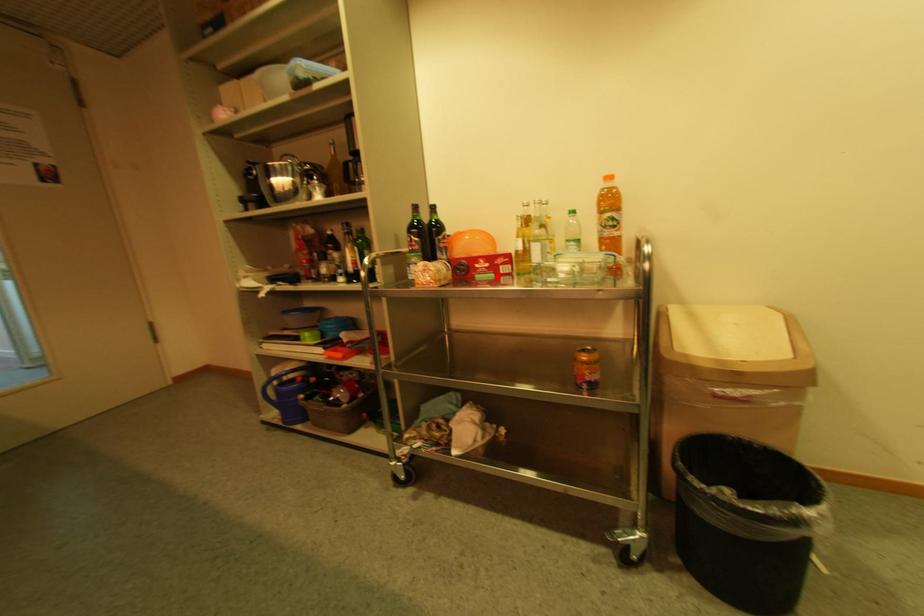
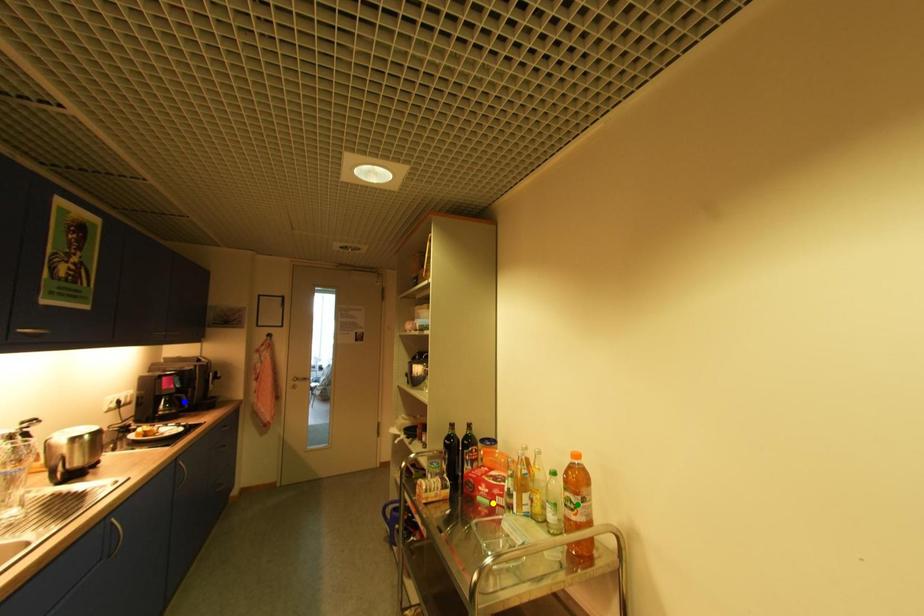
Question: I am providing you with two images of the same scene from different viewpoints. A red point is marked on the first image. You are given multiple points on the second image. Which point in image 2 represents the same 3d spot as the red point in image 1?

Choices:
 (A) blue point
 (B) green point
 (C) yellow point

Answer: (C)